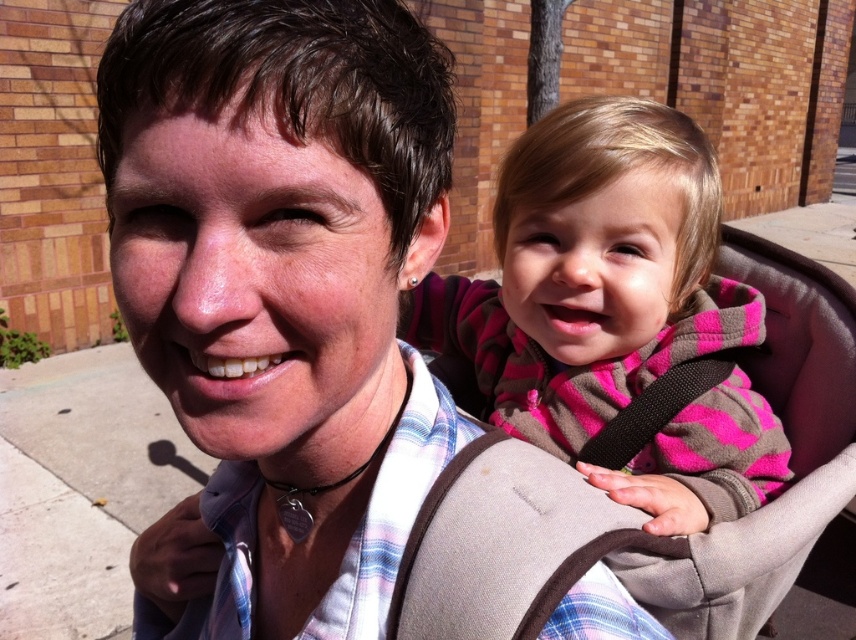
Question: Is pink fleece jacket at upper center further to camera compared to pink fleece jacket at center?

Choices:
 (A) no
 (B) yes

Answer: (A)

Question: Among these points, which one is farthest from the camera?

Choices:
 (A) (510, 314)
 (B) (608, 298)

Answer: (A)

Question: Which of the following is the farthest from the observer?

Choices:
 (A) pink fleece jacket at center
 (B) pink fleece jacket at upper center

Answer: (A)

Question: Does pink fleece jacket at upper center have a greater width compared to pink fleece jacket at center?

Choices:
 (A) no
 (B) yes

Answer: (B)

Question: Does pink fleece jacket at upper center appear under pink fleece jacket at center?

Choices:
 (A) no
 (B) yes

Answer: (A)